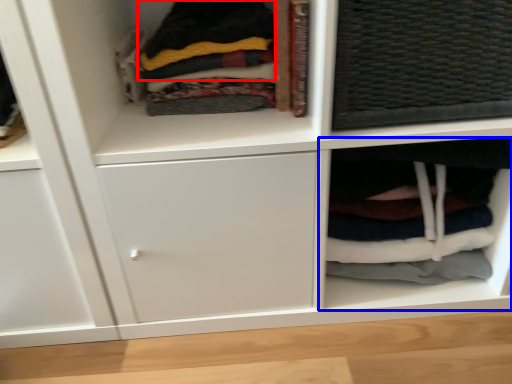
Question: Which object is further to the camera taking this photo, clothing (highlighted by a red box) or cabinet (highlighted by a blue box)?

Choices:
 (A) clothing
 (B) cabinet

Answer: (B)